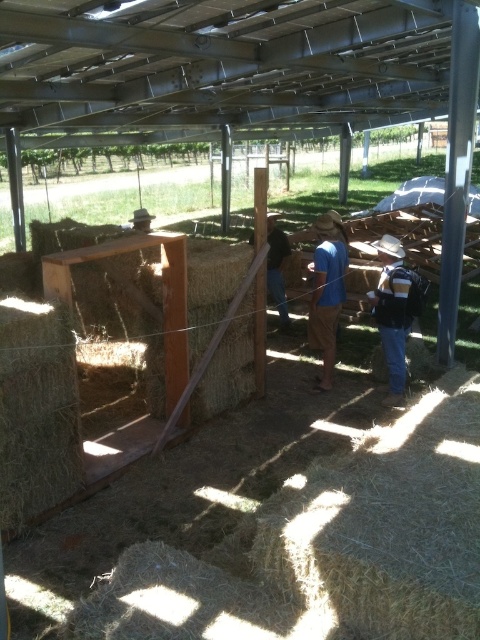
You are standing at the entrance of the metal roof structure looking towards the fenced hay area. You see a blue cotton shirt at center and dark brown leather boots at center. Which item is closer to the ground?

The blue cotton shirt at center is located below dark brown leather boots at center, so the blue cotton shirt at center is closer to the ground.

You are a farmer who needs to retrieve both the denim jacket at center and the blue cotton shirt at center from the fenced area. If your reach is 20 inches, can you grab both items without moving your position?

The denim jacket at center is 19.88 inches away from the blue cotton shirt at center, so yes, you can reach both items since the distance between them is within your 20 inch reach.